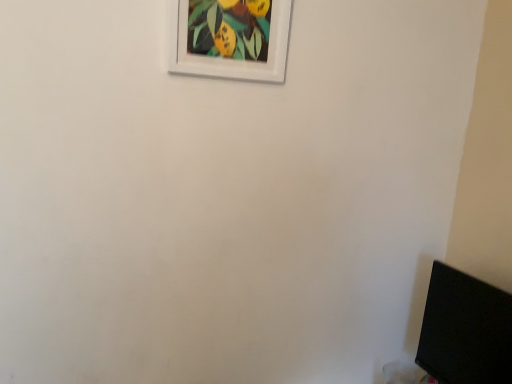
This screenshot has width=512, height=384. What do you see at coordinates (230, 38) in the screenshot?
I see `white matte picture frame at upper center` at bounding box center [230, 38].

What is the approximate width of white matte picture frame at upper center?

1.10 inches.

Identify the location of white matte picture frame at upper center. The height and width of the screenshot is (384, 512). 230,38.

Describe the element at coordinates (465, 330) in the screenshot. Image resolution: width=512 pixels, height=384 pixels. I see `black matte computer monitor at lower right` at that location.

You are a GUI agent. You are given a task and a screenshot of the screen. Output one action in this format:
    pyautogui.click(x=<x>, y=<y>)
    Task: Click on the black matte computer monitor at lower right
    The height and width of the screenshot is (384, 512).
    Given the screenshot: What is the action you would take?
    pyautogui.click(x=465, y=330)

At what (x,y) coordinates should I click in order to perform the action: click on white matte picture frame at upper center. Please return your answer as a coordinate pair (x, y). This screenshot has width=512, height=384. Looking at the image, I should click on (230, 38).

Can you confirm if black matte computer monitor at lower right is positioned to the right of white matte picture frame at upper center?

Correct, you'll find black matte computer monitor at lower right to the right of white matte picture frame at upper center.

Is the position of black matte computer monitor at lower right more distant than that of white matte picture frame at upper center?

No, the depth of black matte computer monitor at lower right is less than that of white matte picture frame at upper center.

Is point (455, 375) closer or farther from the camera than point (175, 29)?

Point (455, 375) is farther from the camera than point (175, 29).

From the image's perspective, does black matte computer monitor at lower right appear lower than white matte picture frame at upper center?

Indeed, from the image's perspective, black matte computer monitor at lower right is shown beneath white matte picture frame at upper center.

From a real-world perspective, is black matte computer monitor at lower right located beneath white matte picture frame at upper center?

Indeed, from a real-world perspective, black matte computer monitor at lower right is positioned beneath white matte picture frame at upper center.

Considering the relative sizes of black matte computer monitor at lower right and white matte picture frame at upper center in the image provided, is black matte computer monitor at lower right thinner than white matte picture frame at upper center?

In fact, black matte computer monitor at lower right might be wider than white matte picture frame at upper center.

In terms of height, does black matte computer monitor at lower right look taller or shorter compared to white matte picture frame at upper center?

Clearly, black matte computer monitor at lower right is taller compared to white matte picture frame at upper center.

Who is smaller, black matte computer monitor at lower right or white matte picture frame at upper center?

white matte picture frame at upper center is smaller.

Is white matte picture frame at upper center inside black matte computer monitor at lower right?

No, white matte picture frame at upper center is not surrounded by black matte computer monitor at lower right.

Is black matte computer monitor at lower right touching white matte picture frame at upper center?

black matte computer monitor at lower right is not next to white matte picture frame at upper center, and they're not touching.

Is black matte computer monitor at lower right oriented towards white matte picture frame at upper center?

No.

What's the angular difference between black matte computer monitor at lower right and white matte picture frame at upper center's facing directions?

They differ by 85.3 degrees in their facing directions.

How much distance is there between black matte computer monitor at lower right and white matte picture frame at upper center?

A distance of 32.33 inches exists between black matte computer monitor at lower right and white matte picture frame at upper center.

The height and width of the screenshot is (384, 512). Identify the location of picture frame behind the black matte computer monitor at lower right. (230, 38).

Considering the positions of objects white matte picture frame at upper center and black matte computer monitor at lower right in the image provided, who is more to the right, white matte picture frame at upper center or black matte computer monitor at lower right?

black matte computer monitor at lower right is more to the right.

Does white matte picture frame at upper center lie in front of black matte computer monitor at lower right?

No, white matte picture frame at upper center is further to the viewer.

Which is more distant, [258,57] or [506,343]?

The point [258,57] is behind.

From the image's perspective, which one is positioned higher, white matte picture frame at upper center or black matte computer monitor at lower right?

From the image's view, white matte picture frame at upper center is above.

From a real-world perspective, relative to black matte computer monitor at lower right, is white matte picture frame at upper center vertically above or below?

Clearly, from a real-world perspective, white matte picture frame at upper center is above black matte computer monitor at lower right.

Considering the relative sizes of white matte picture frame at upper center and black matte computer monitor at lower right in the image provided, is white matte picture frame at upper center thinner than black matte computer monitor at lower right?

Correct, the width of white matte picture frame at upper center is less than that of black matte computer monitor at lower right.

Looking at this image, is white matte picture frame at upper center taller or shorter than black matte computer monitor at lower right?

white matte picture frame at upper center is shorter than black matte computer monitor at lower right.

Considering the sizes of white matte picture frame at upper center and black matte computer monitor at lower right in the image, is white matte picture frame at upper center bigger or smaller than black matte computer monitor at lower right?

In the image, white matte picture frame at upper center appears to be smaller than black matte computer monitor at lower right.

Is black matte computer monitor at lower right located within white matte picture frame at upper center?

No.

Are white matte picture frame at upper center and black matte computer monitor at lower right located far from each other?

white matte picture frame at upper center is near black matte computer monitor at lower right, not far away.

Does white matte picture frame at upper center turn towards black matte computer monitor at lower right?

No, white matte picture frame at upper center is not oriented towards black matte computer monitor at lower right.

Can you tell me how much white matte picture frame at upper center and black matte computer monitor at lower right differ in facing direction?

The facing directions of white matte picture frame at upper center and black matte computer monitor at lower right are 85.3 degrees apart.

I want to click on picture frame above the black matte computer monitor at lower right (from the image's perspective), so click(x=230, y=38).

Locate an element on the screen. The width and height of the screenshot is (512, 384). computer monitor directly beneath the white matte picture frame at upper center (from a real-world perspective) is located at coordinates (465, 330).

This screenshot has width=512, height=384. In order to click on picture frame to the left of black matte computer monitor at lower right in this screenshot , I will do `click(230, 38)`.